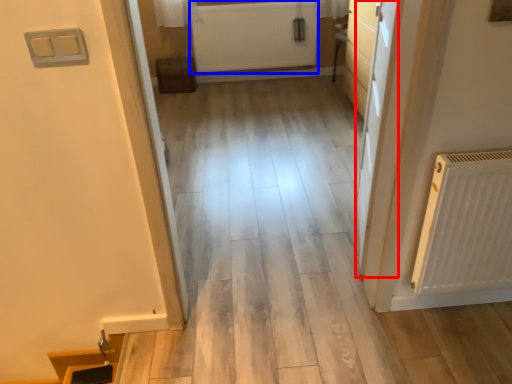
Question: Among these objects, which one is nearest to the camera, door (highlighted by a red box) or radiator (highlighted by a blue box)?

Choices:
 (A) door
 (B) radiator

Answer: (A)